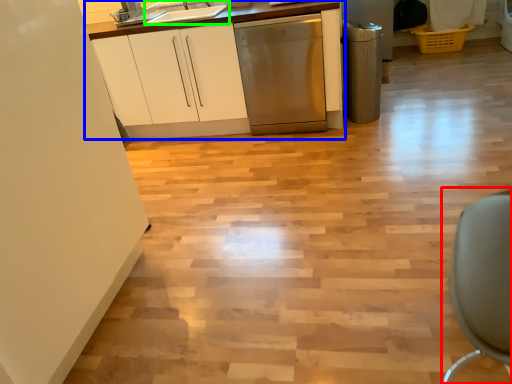
Question: Which object is positioned farthest from swivel chair (highlighted by a red box)? Select from cabinetry (highlighted by a blue box) and sink (highlighted by a green box).

Choices:
 (A) cabinetry
 (B) sink

Answer: (A)